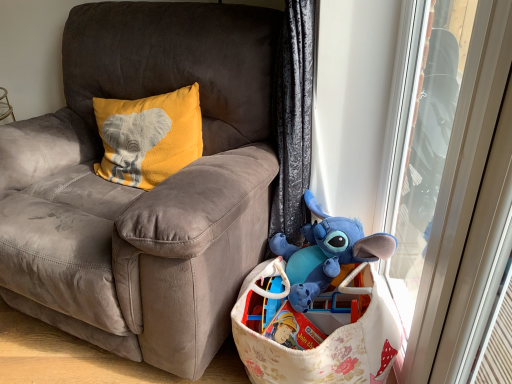
Question: Is transparent plastic screen door at right inside or outside of fluffy white fabric basket at lower right?

Choices:
 (A) inside
 (B) outside

Answer: (B)

Question: From a real-world perspective, relative to fluffy white fabric basket at lower right, is transparent plastic screen door at right vertically above or below?

Choices:
 (A) above
 (B) below

Answer: (A)

Question: Estimate the real-world distances between objects in this image. Which object is closer to the transparent plastic screen door at right?

Choices:
 (A) suede gray chair at center
 (B) fluffy white fabric basket at lower right
 (C) blue plush toy at lower right

Answer: (B)

Question: Which object is positioned closest to the blue plush toy at lower right?

Choices:
 (A) fluffy white fabric basket at lower right
 (B) transparent plastic screen door at right
 (C) suede gray chair at center

Answer: (A)